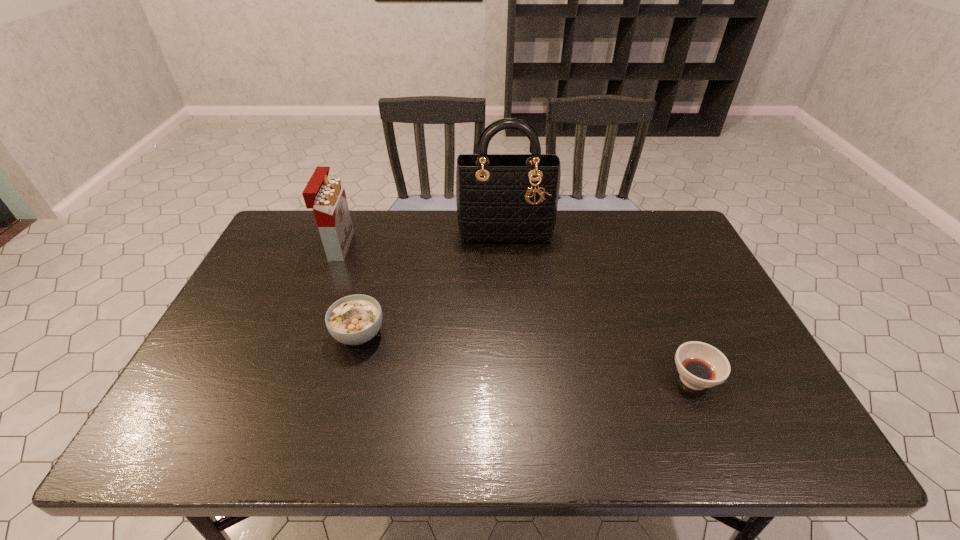
Find the location of a particular element. This screenshot has height=540, width=960. handbag is located at coordinates (504, 198).

Identify the location of the third object from left to right. (504, 198).

Locate an element on the screen. The width and height of the screenshot is (960, 540). the second tallest object is located at coordinates (326, 196).

Locate an element on the screen. the leftmost object is located at coordinates (326, 196).

The image size is (960, 540). What are the coordinates of `the left soup bowl` in the screenshot? It's located at (355, 319).

You are a GUI agent. You are given a task and a screenshot of the screen. Output one action in this format:
    pyautogui.click(x=<x>, y=<y>)
    Task: Click on the third object from right to left
    
    Given the screenshot: What is the action you would take?
    pyautogui.click(x=355, y=319)

In order to click on the shorter soup bowl in this screenshot , I will do `click(700, 365)`.

Locate an element on the screen. The height and width of the screenshot is (540, 960). the nearer soup bowl is located at coordinates (700, 365).

Where is `vacant region located 0.160m at the front of the handbag with visible charms`? Image resolution: width=960 pixels, height=540 pixels. vacant region located 0.160m at the front of the handbag with visible charms is located at coordinates (509, 278).

What are the coordinates of `blank space located with the lid open on the leftmost object` in the screenshot? It's located at (461, 246).